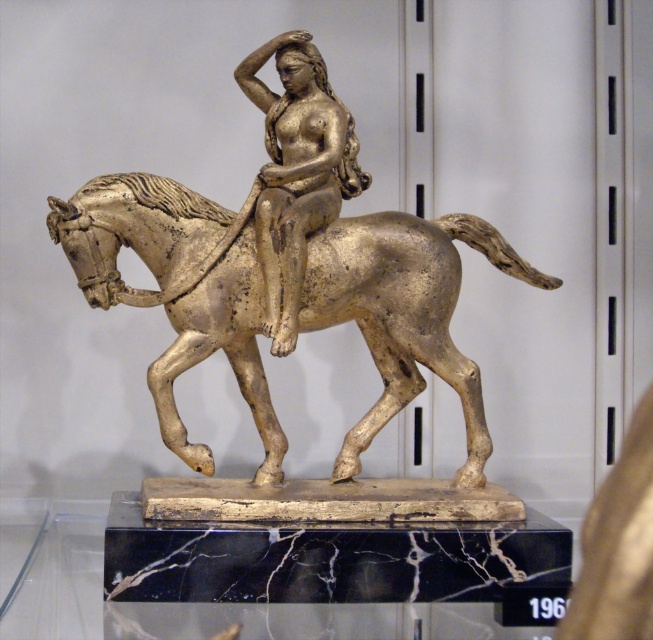
Can you confirm if gold polished horse at center is shorter than gold metallic figure at center?

Yes, gold polished horse at center is shorter than gold metallic figure at center.

Between point (244, 381) and point (261, 252), which one is positioned in front?

Point (261, 252) is more forward.

Image resolution: width=653 pixels, height=640 pixels. What are the coordinates of `gold polished horse at center` in the screenshot? It's located at (178, 298).